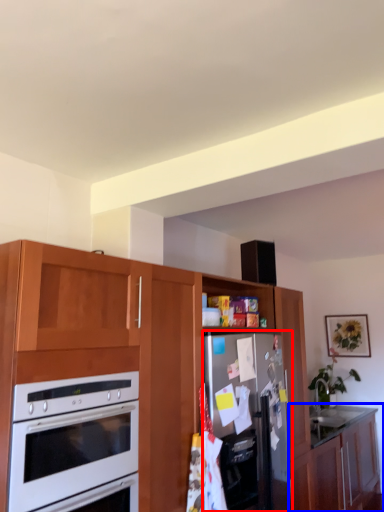
Question: Which point is closer to the camera, refrigerator (highlighted by a red box) or cabinetry (highlighted by a blue box)?

Choices:
 (A) refrigerator
 (B) cabinetry

Answer: (A)